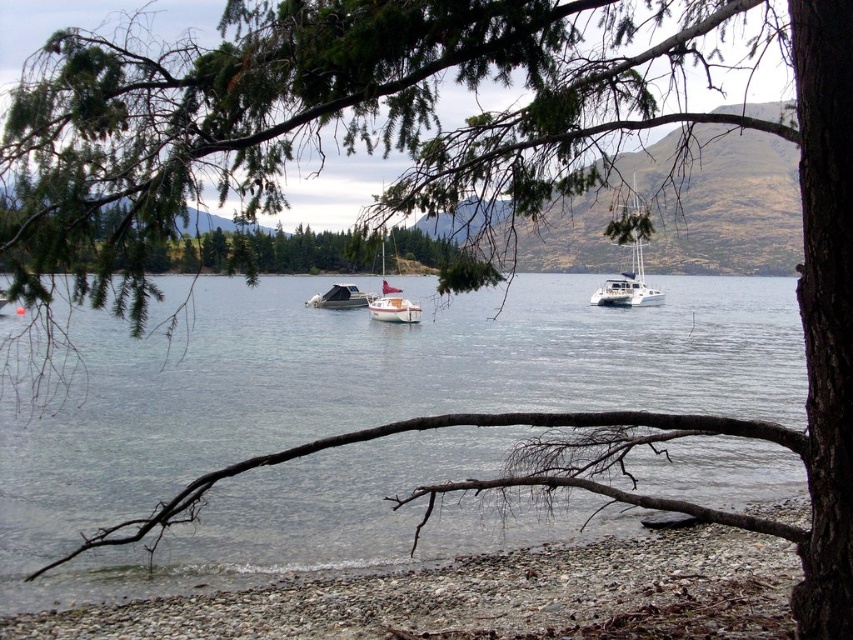
You are a photographer trying to capture the white glossy sailboat at center and the matte white sailboat at center in a single shot. However, the dark brown tree branch in the foreground is blocking your view. Which of the two sailboats is more likely obscured by the branch?

The white glossy sailboat at center is positioned under the matte white sailboat at center, so the glossy sailboat is more likely obscured by the branch since it is behind the matte one.